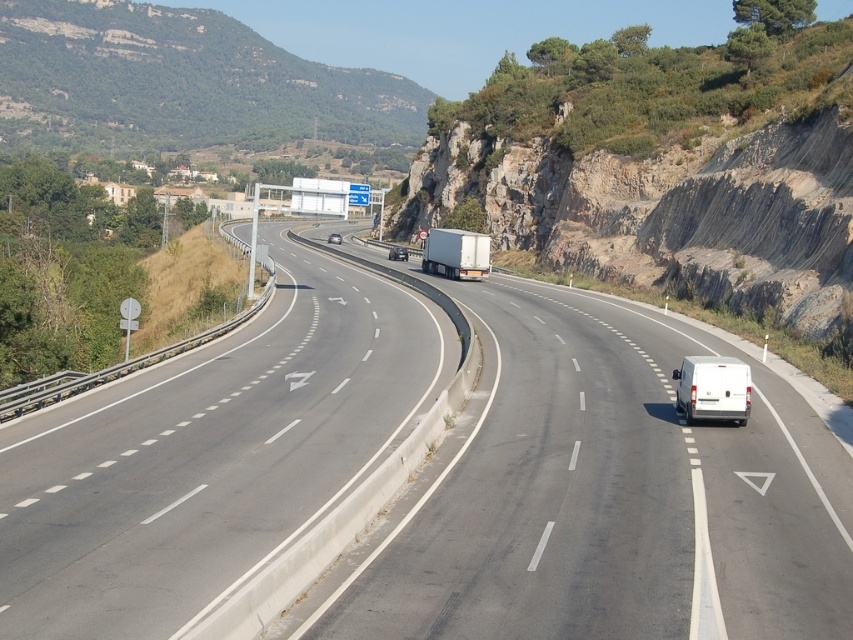
Which is above, white matte trailer truck at center or shiny silver sedan at center?

Positioned higher is shiny silver sedan at center.

Is point (486, 268) closer to viewer compared to point (393, 253)?

Yes, it is.

Find the location of a particular element. white matte trailer truck at center is located at coordinates (456, 253).

Between white matte van at center-right and white matte van at right, which one has more height?

white matte van at center-right is taller.

Does white matte van at center-right have a greater height compared to white matte van at right?

Correct, white matte van at center-right is much taller as white matte van at right.

Where is `white matte van at center-right`? The height and width of the screenshot is (640, 853). white matte van at center-right is located at coordinates click(602, 497).

This screenshot has width=853, height=640. What do you see at coordinates (665, 164) in the screenshot? I see `rocky cliff at upper right` at bounding box center [665, 164].

Image resolution: width=853 pixels, height=640 pixels. Identify the location of rocky cliff at upper right. (665, 164).